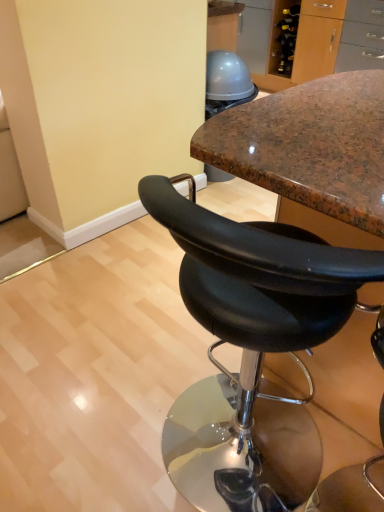
Question: From a real-world perspective, is black leather stool at center, which appears as the second chair when viewed from the left, beneath black leather stool at center, which is counted as the 2th chair, starting from the right?

Choices:
 (A) no
 (B) yes

Answer: (A)

Question: Considering the relative positions of black leather stool at center, which appears as the second chair when viewed from the left, and black leather stool at center, which is counted as the 2th chair, starting from the right, in the image provided, is black leather stool at center, which appears as the second chair when viewed from the left, to the left of black leather stool at center, which is counted as the 2th chair, starting from the right, from the viewer's perspective?

Choices:
 (A) yes
 (B) no

Answer: (B)

Question: Could you tell me if black leather stool at center, which is the 1th chair in right-to-left order, is turned towards black leather stool at center, marked as the 1th chair in a left-to-right arrangement?

Choices:
 (A) yes
 (B) no

Answer: (B)

Question: Is black leather stool at center, which is the 1th chair in right-to-left order, thinner than black leather stool at center, marked as the 1th chair in a left-to-right arrangement?

Choices:
 (A) yes
 (B) no

Answer: (B)

Question: Does black leather stool at center, which is the 1th chair in right-to-left order, have a smaller size compared to black leather stool at center, which is counted as the 2th chair, starting from the right?

Choices:
 (A) yes
 (B) no

Answer: (B)

Question: Does black leather stool at center, which appears as the second chair when viewed from the left, contain black leather stool at center, marked as the 1th chair in a left-to-right arrangement?

Choices:
 (A) yes
 (B) no

Answer: (A)

Question: Is black leather stool at center, which is counted as the 2th chair, starting from the right, positioned beyond the bounds of black leather stool at center, which is the 1th chair in right-to-left order?

Choices:
 (A) yes
 (B) no

Answer: (B)

Question: Would you say black leather stool at center, marked as the 1th chair in a left-to-right arrangement, is a long distance from black leather stool at center, which appears as the second chair when viewed from the left?

Choices:
 (A) no
 (B) yes

Answer: (A)

Question: Could black leather stool at center, which is the 1th chair in right-to-left order, be considered to be inside black leather stool at center, marked as the 1th chair in a left-to-right arrangement?

Choices:
 (A) yes
 (B) no

Answer: (B)

Question: Is black leather stool at center, marked as the 1th chair in a left-to-right arrangement, shorter than black leather stool at center, which is the 1th chair in right-to-left order?

Choices:
 (A) no
 (B) yes

Answer: (B)

Question: From a real-world perspective, is black leather stool at center, marked as the 1th chair in a left-to-right arrangement, under black leather stool at center, which is the 1th chair in right-to-left order?

Choices:
 (A) no
 (B) yes

Answer: (B)

Question: Is the position of black leather stool at center, which is counted as the 2th chair, starting from the right, less distant than that of black leather stool at center, which is the 1th chair in right-to-left order?

Choices:
 (A) no
 (B) yes

Answer: (B)

Question: From a real-world perspective, is black leather stool at center, which appears as the second chair when viewed from the left, positioned above or below black leather stool at center, marked as the 1th chair in a left-to-right arrangement?

Choices:
 (A) below
 (B) above

Answer: (B)